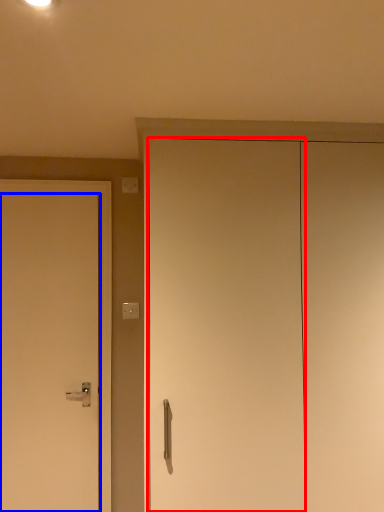
Question: Which object appears farthest to the camera in this image, door (highlighted by a red box) or door (highlighted by a blue box)?

Choices:
 (A) door
 (B) door

Answer: (B)